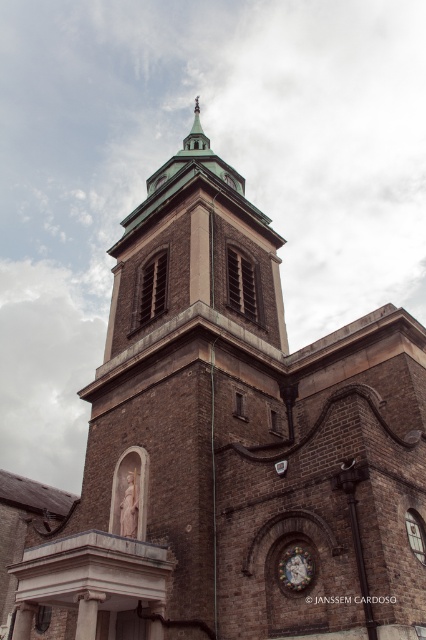
You are a drone operator planning to fly a drone from the matte gold clock at center to the green metallic spire at upper center. What is the approximate distance you need to cover between the two points?

The approximate distance between the matte gold clock at center and the green metallic spire at upper center is 54.25 meters.

You are standing in front of the historic brick church and want to determine the spatial relationship between two points marked in the image. Which point, point [311,572] or point [199,152], is closer to you?

Point [311,572] is closer to the viewer than point [199,152].

You are standing in front of the historic brick church and want to take a photo of both the matte gold clock at center and the green metallic spire at upper center. However, you notice that one of them might be partially hidden by the other. Which object is blocking the view of the other?

The matte gold clock at center is in front of the green metallic spire at upper center, so the clock is blocking the view of the spire.